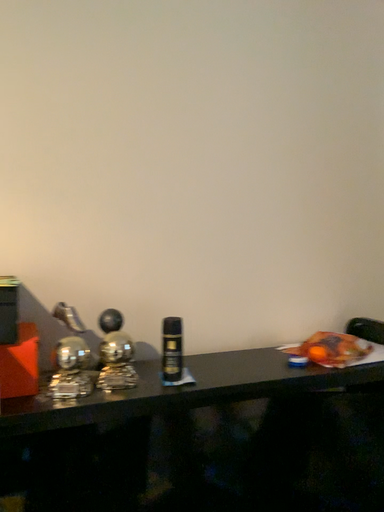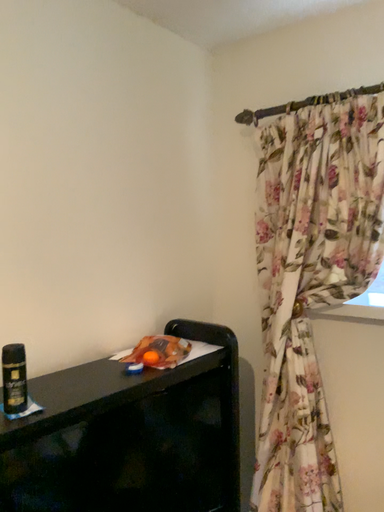
Question: How did the camera likely rotate when shooting the video?

Choices:
 (A) rotated right
 (B) rotated left

Answer: (A)